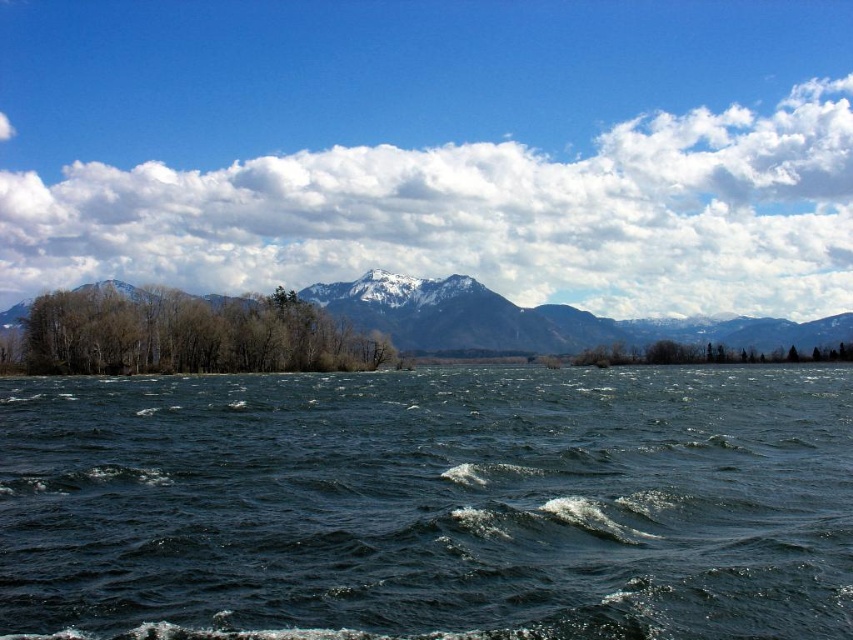
You are an outdoor photographer planning to capture a landscape shot that includes both the snowy mountain at upper center and the green leafy trees at center. Based on the scene, which of these two elements is closer to the camera?

The snowy mountain at upper center is closer to the camera than the green leafy trees at center because it is positioned in front of them.

What is the color of the water at the point marked by coordinates (x=428, y=504)?

The water at point (x=428, y=504) is dark blue.

Looking at this image, you are standing at the point closest to the mountains in this landscape. Which point, point [788,452] or point [712,266], is closer to you?

Point [788,452] is in front of point [712,266], so it is closer to you.